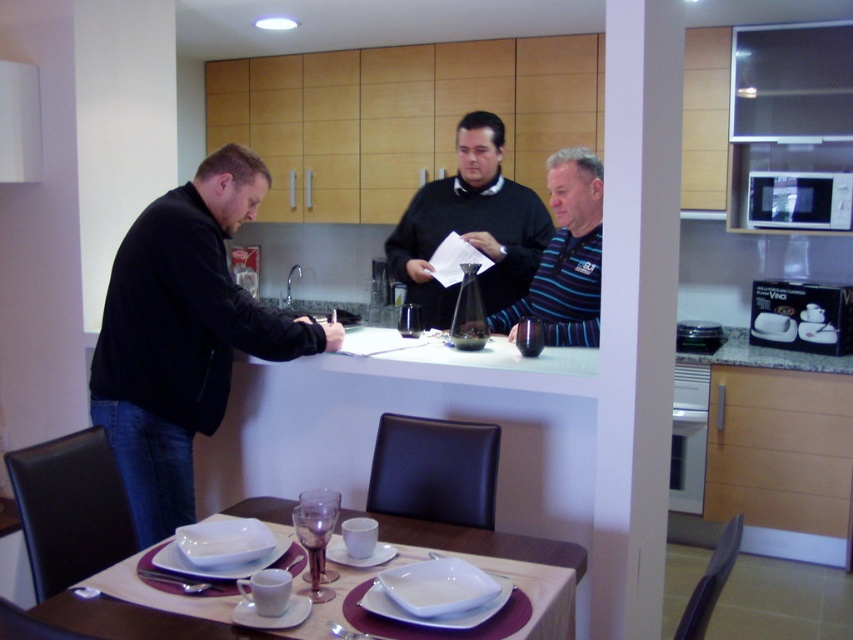
Can you confirm if striped polo shirt at center is thinner than clear glass wine glass at table center?

Incorrect, striped polo shirt at center's width is not less than clear glass wine glass at table center's.

This screenshot has width=853, height=640. Describe the element at coordinates (566, 257) in the screenshot. I see `striped polo shirt at center` at that location.

Describe the element at coordinates (566, 257) in the screenshot. I see `striped polo shirt at center` at that location.

Locate an element on the screen. Image resolution: width=853 pixels, height=640 pixels. striped polo shirt at center is located at coordinates (566, 257).

Is point (399, 272) positioned behind point (460, 532)?

Yes.

Who is positioned more to the left, matte black sweater at center or white glossy table at center?

Positioned to the left is white glossy table at center.

Does point (450, 214) lie behind point (190, 620)?

Yes, it is.

In order to click on matte black sweater at center in this screenshot , I will do `click(469, 225)`.

Is black matte jacket at left to the left of clear glass wine glass at table center from the viewer's perspective?

Correct, you'll find black matte jacket at left to the left of clear glass wine glass at table center.

Can you confirm if black matte jacket at left is smaller than clear glass wine glass at table center?

No.

The image size is (853, 640). Identify the location of black matte jacket at left. (183, 336).